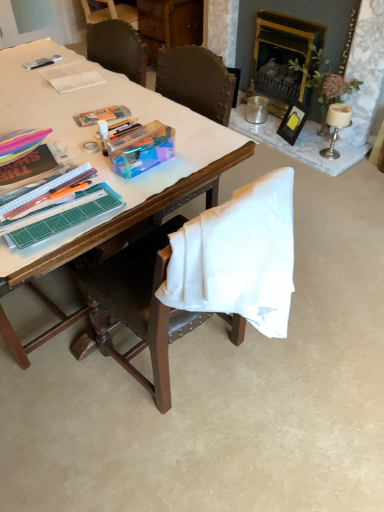
This screenshot has width=384, height=512. What are the coordinates of `free space in front of white paper at upper left` in the screenshot? It's located at (89, 98).